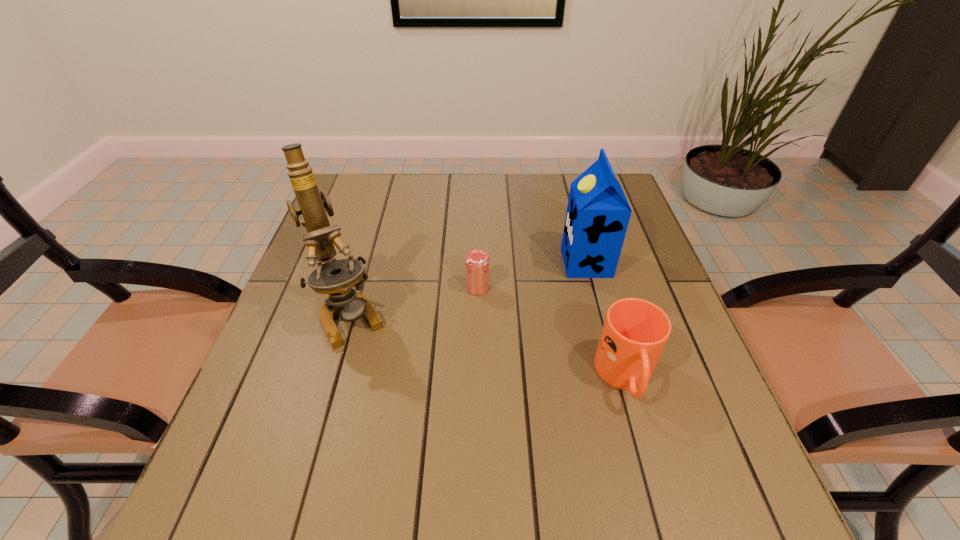
Find the location of a particular element. Image resolution: width=960 pixels, height=540 pixels. free space between the beer can and the leftmost object is located at coordinates (414, 302).

Where is `free spot between the second shortest object and the beer can`? The height and width of the screenshot is (540, 960). free spot between the second shortest object and the beer can is located at coordinates (552, 333).

Where is `free spot between the second object from left to right and the mug`? The height and width of the screenshot is (540, 960). free spot between the second object from left to right and the mug is located at coordinates (552, 333).

The height and width of the screenshot is (540, 960). In order to click on free space between the second object from left to right and the third tallest object in this screenshot , I will do 552,333.

Find the location of a particular element. blank region between the mug and the leftmost object is located at coordinates (488, 347).

Locate an element on the screen. The image size is (960, 540). free space between the third tallest object and the second object from left to right is located at coordinates 552,333.

Where is `free space between the second object from left to right and the leftmost object`? This screenshot has height=540, width=960. free space between the second object from left to right and the leftmost object is located at coordinates (414, 302).

Find the location of a particular element. object identified as the third closest to the microscope is located at coordinates point(635,331).

Locate an element on the screen. object that ranks as the closest to the farthest object is located at coordinates (477, 261).